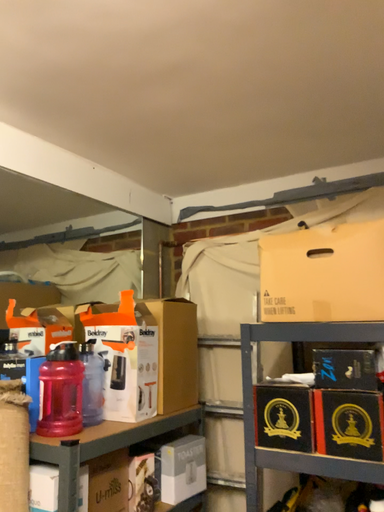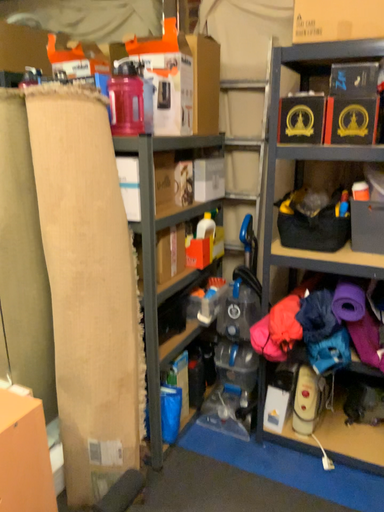
Question: Which way did the camera rotate in the video?

Choices:
 (A) rotated downward
 (B) rotated upward

Answer: (A)